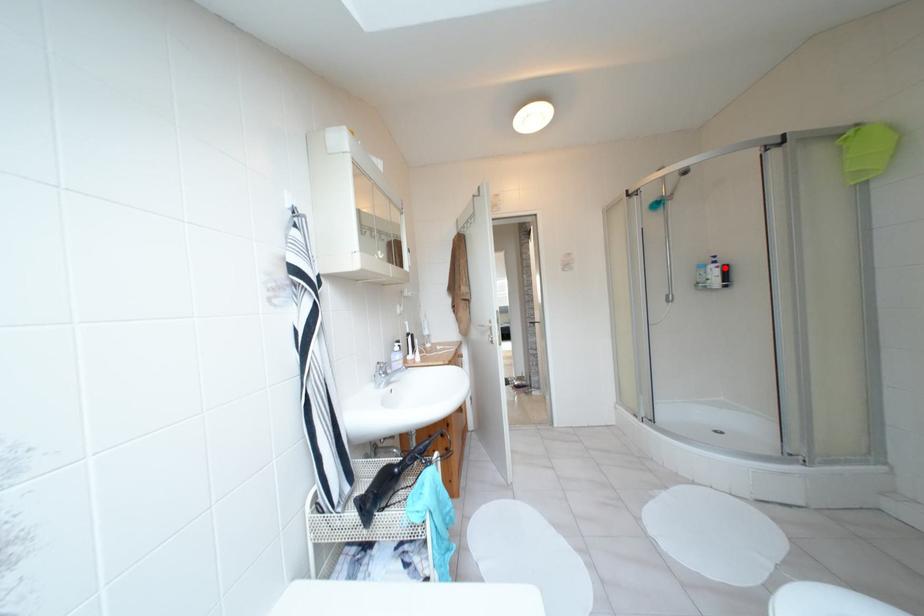
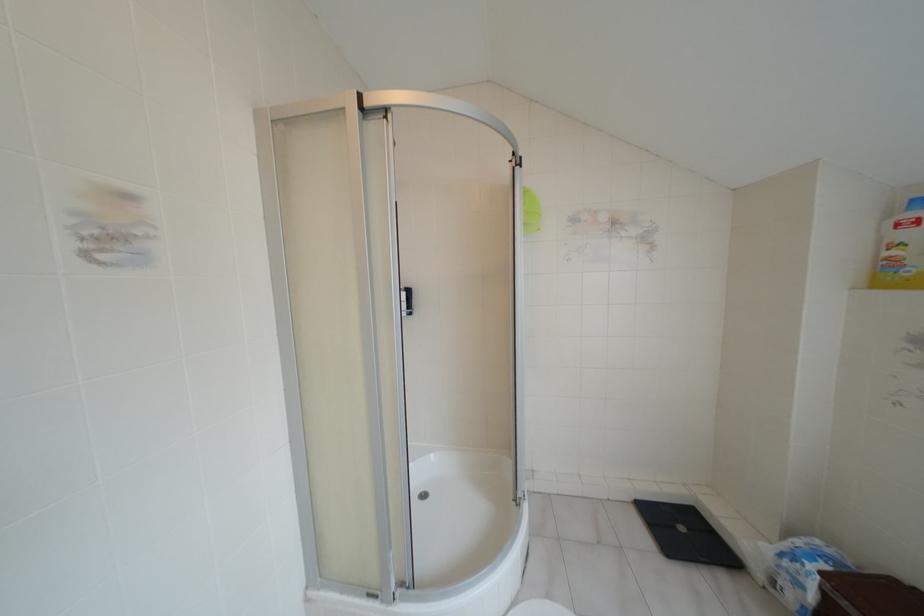
In the second image, find the point that corresponds to the highlighted location in the first image.

(407, 292)